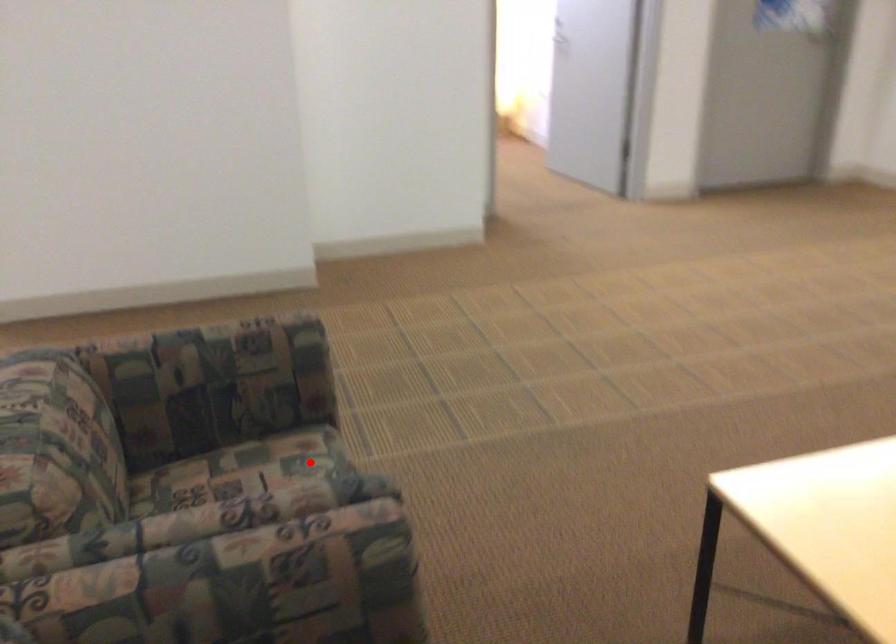
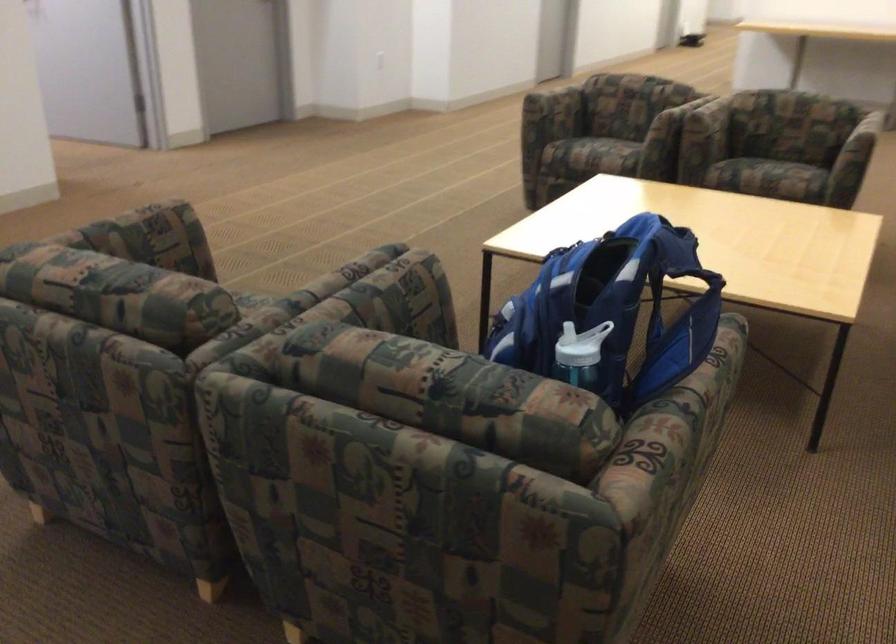
Find the pixel in the second image that matches the highlighted location in the first image.

(250, 298)